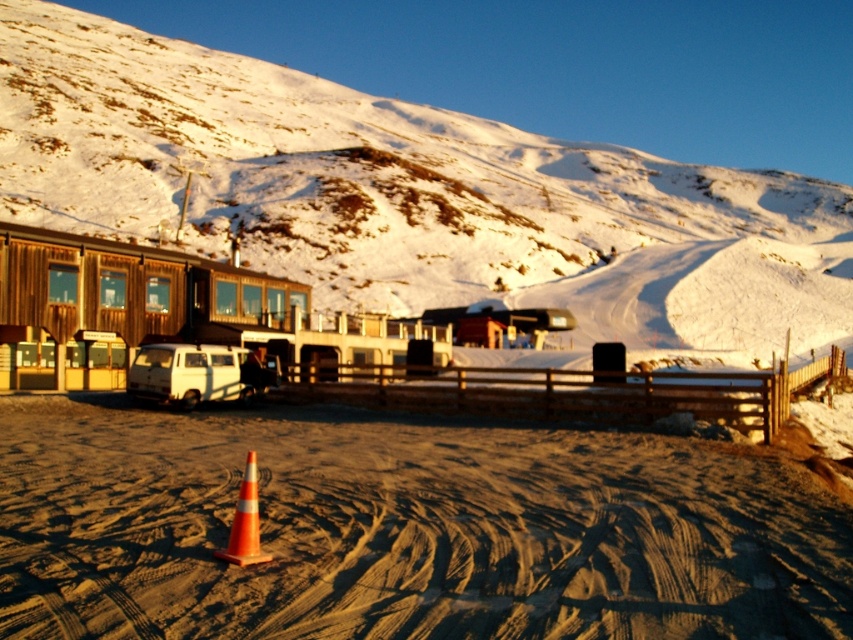
Question: Which point appears closest to the camera in this image?

Choices:
 (A) (267, 381)
 (B) (78, 177)

Answer: (A)

Question: Does smooth sand track at center come behind orange reflective cone at center?

Choices:
 (A) no
 (B) yes

Answer: (A)

Question: Is snowy white mountain at upper center wider than white matte van at center?

Choices:
 (A) no
 (B) yes

Answer: (B)

Question: Estimate the real-world distances between objects in this image. Which object is farther from the smooth sand track at center?

Choices:
 (A) snowy white mountain at upper center
 (B) orange reflective cone at center

Answer: (A)

Question: Can you confirm if snowy white mountain at upper center is smaller than white matte van at center?

Choices:
 (A) no
 (B) yes

Answer: (A)

Question: Which object is the farthest from the orange reflective cone at center?

Choices:
 (A) smooth sand track at center
 (B) white matte van at center
 (C) snowy white mountain at upper center

Answer: (C)